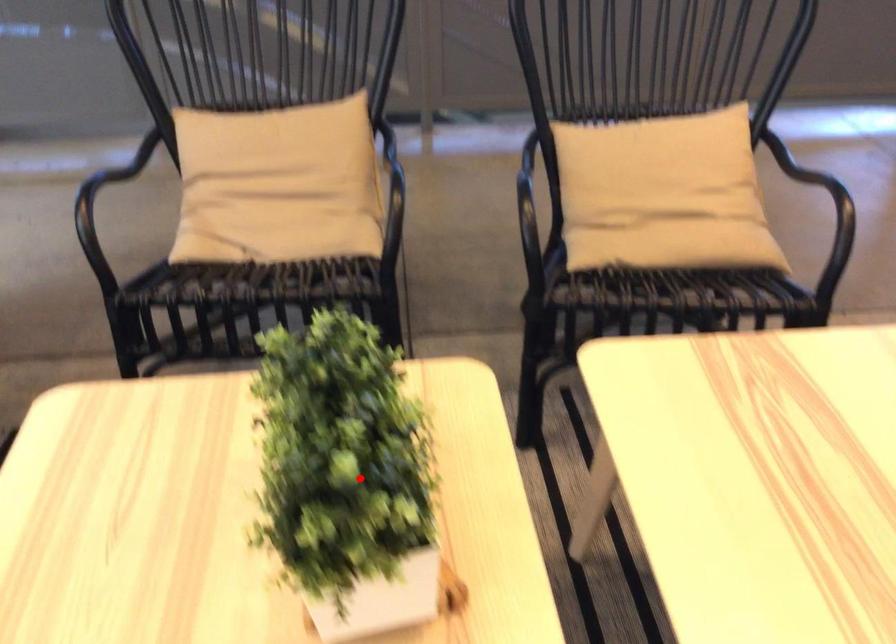
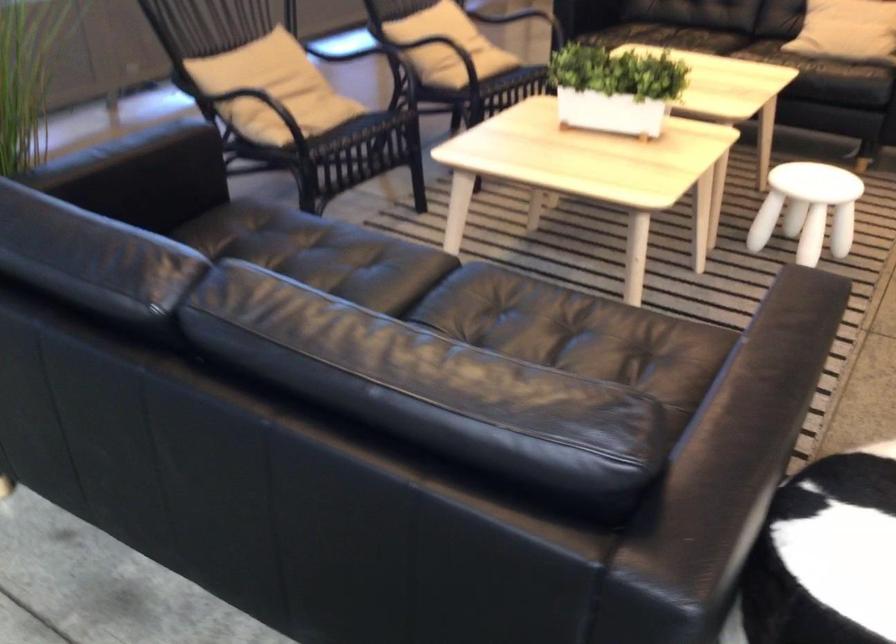
Question: I am providing you with two images of the same scene from different viewpoints. Given a red point in image1, look at the same physical point in image2. Is it:

Choices:
 (A) Closer to the viewpoint
 (B) Farther from the viewpoint

Answer: (B)